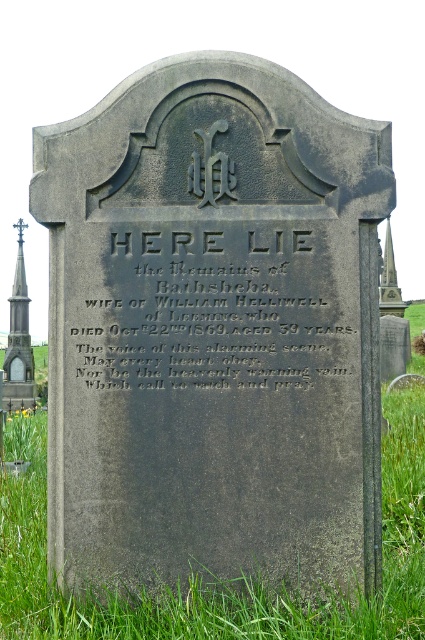
Question: Is green grass at lower center above polished stone spire at left?

Choices:
 (A) yes
 (B) no

Answer: (B)

Question: Which object appears closest to the camera in this image?

Choices:
 (A) green grass at lower center
 (B) stone spire at right
 (C) polished stone spire at left

Answer: (A)

Question: In this image, where is black stone inscription at center located relative to green grass at lower center?

Choices:
 (A) left
 (B) right

Answer: (A)

Question: Is black stone inscription at center thinner than green grass at lower center?

Choices:
 (A) yes
 (B) no

Answer: (A)

Question: Which object appears closest to the camera in this image?

Choices:
 (A) black stone inscription at center
 (B) green grass at lower center
 (C) polished stone spire at left

Answer: (B)

Question: Which point appears farthest from the camera in this image?

Choices:
 (A) (238, 250)
 (B) (8, 408)
 (C) (388, 307)
 (D) (141, 596)

Answer: (C)